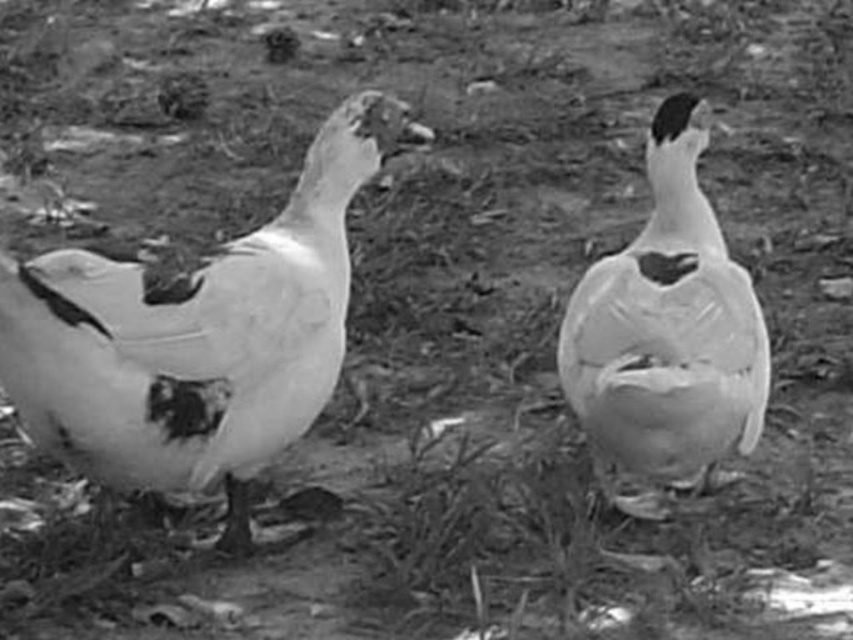
Question: Can you confirm if white matte goose at left is positioned to the left of white matte duck at center?

Choices:
 (A) yes
 (B) no

Answer: (A)

Question: Can you confirm if white matte goose at left is bigger than white matte duck at center?

Choices:
 (A) yes
 (B) no

Answer: (A)

Question: Which point is farther from the camera taking this photo?

Choices:
 (A) (592, 412)
 (B) (141, 448)

Answer: (A)

Question: Which object appears closest to the camera in this image?

Choices:
 (A) white matte duck at center
 (B) white matte goose at left

Answer: (B)

Question: Does white matte goose at left have a smaller size compared to white matte duck at center?

Choices:
 (A) no
 (B) yes

Answer: (A)